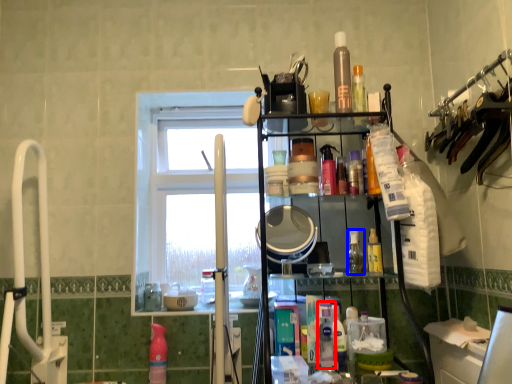
Question: Which of the following is the farthest to the observer, cleaning product (highlighted by a red box) or toiletry (highlighted by a blue box)?

Choices:
 (A) cleaning product
 (B) toiletry

Answer: (B)